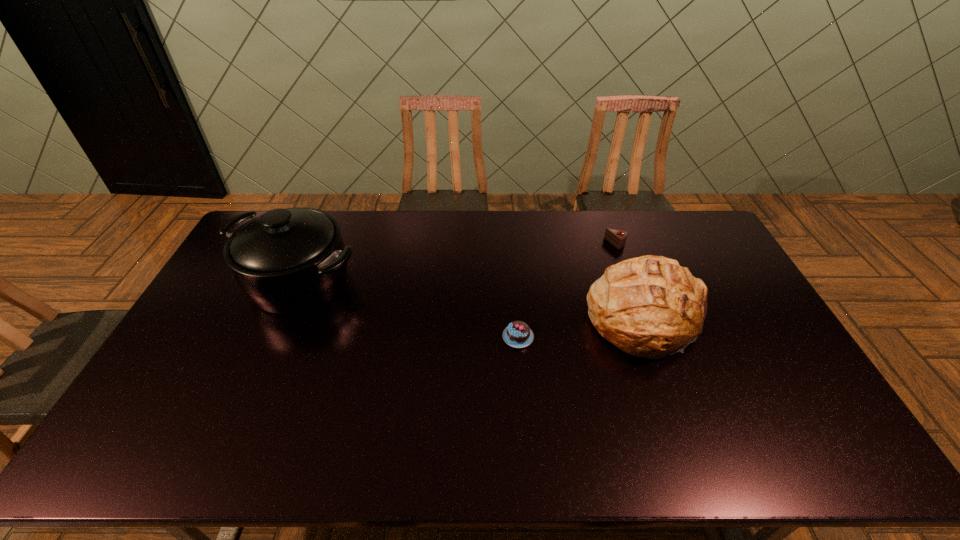
Locate which object ranks third in proximity to the bread. Please provide its 2D coordinates. Your answer should be formatted as a tuple, i.e. [(x, y)], where the tuple contains the x and y coordinates of a point satisfying the conditions above.

[(287, 261)]

The image size is (960, 540). What are the coordinates of `vacant space that satisfies the following two spatial constraints: 1. on the front side of the right chocolate cake; 2. on the right side of the bread` in the screenshot? It's located at (643, 319).